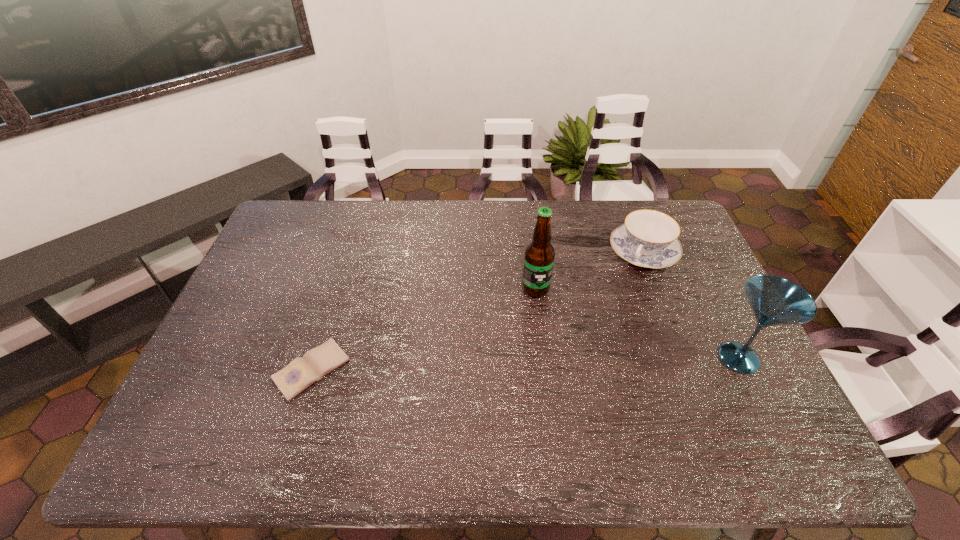
At what (x,y) coordinates should I click in order to perform the action: click on free space at the far edge of the desktop. Please return your answer as a coordinate pair (x, y). The image size is (960, 540). Looking at the image, I should click on pyautogui.click(x=563, y=206).

Where is `vacant space at the near edge of the desktop`? The image size is (960, 540). vacant space at the near edge of the desktop is located at coordinates (443, 389).

I want to click on free space at the left edge of the desktop, so point(243,328).

This screenshot has height=540, width=960. I want to click on vacant region at the right edge of the desktop, so click(x=689, y=286).

In the image, there is a desktop. In order to click on vacant region at the far left corner in this screenshot , I will do `click(328, 200)`.

Where is `free area in between the third object from right to left and the third shortest object`? This screenshot has height=540, width=960. free area in between the third object from right to left and the third shortest object is located at coordinates (637, 323).

The width and height of the screenshot is (960, 540). What are the coordinates of `empty space between the tallest object and the farthest object` in the screenshot? It's located at (589, 271).

This screenshot has width=960, height=540. What are the coordinates of `free space between the beer bottle and the farthest object` in the screenshot? It's located at (589, 271).

The width and height of the screenshot is (960, 540). I want to click on vacant space in between the second shortest object and the beer bottle, so click(589, 271).

I want to click on free area in between the second shortest object and the second object from left to right, so click(589, 271).